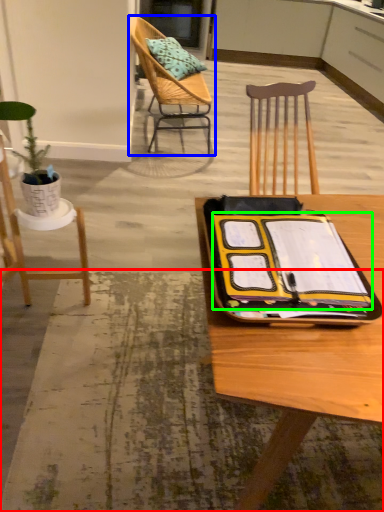
Question: Which is farther away from place mat (highlighted by a red box)? chair (highlighted by a blue box) or notebook (highlighted by a green box)?

Choices:
 (A) chair
 (B) notebook

Answer: (A)